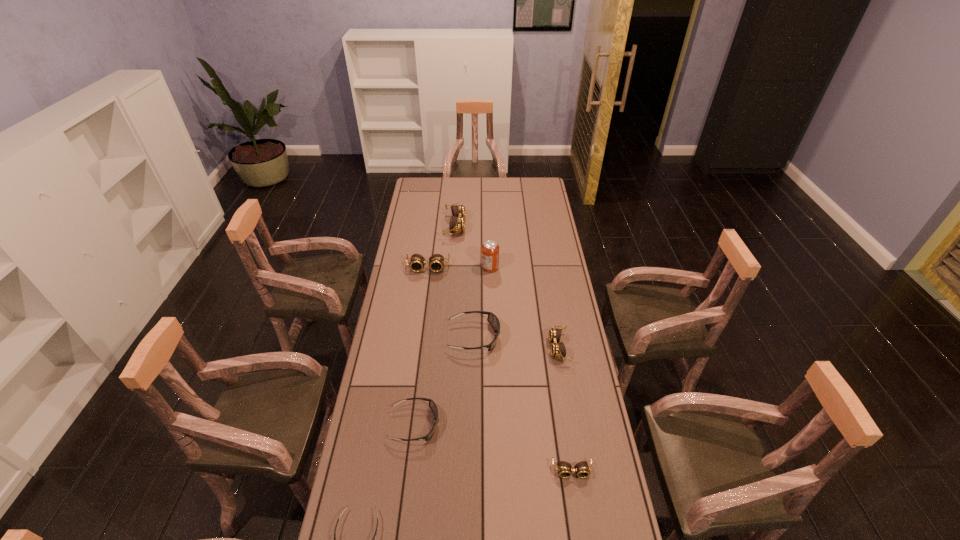
Find the location of a particular element. This screenshot has width=960, height=540. orange can is located at coordinates (490, 249).

Where is `can`? can is located at coordinates (490, 249).

Locate an element on the screen. Image resolution: width=960 pixels, height=540 pixels. the seventh shortest object is located at coordinates (457, 222).

The width and height of the screenshot is (960, 540). I want to click on the farthest object, so click(x=457, y=222).

This screenshot has height=540, width=960. Find the location of `the sixth shortest goggles`. the sixth shortest goggles is located at coordinates (436, 262).

This screenshot has width=960, height=540. Identify the location of the third tallest object. (436, 262).

The height and width of the screenshot is (540, 960). I want to click on the farthest black goggles, so click(492, 318).

You are a GUI agent. You are given a task and a screenshot of the screen. Output one action in this format:
    pyautogui.click(x=<x>, y=<y>)
    Task: Click on the biggest black goggles
    The height and width of the screenshot is (540, 960).
    Given the screenshot: What is the action you would take?
    pyautogui.click(x=492, y=318)

The height and width of the screenshot is (540, 960). In order to click on the third farthest brown goggles in this screenshot , I will do click(x=558, y=350).

I want to click on the second nearest black goggles, so click(432, 405).